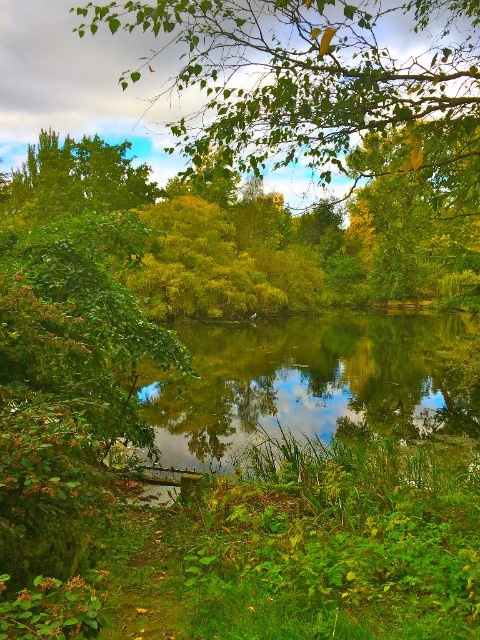
You are standing at the center of the scene and want to locate the green leafy tree at upper center. According to the coordinates provided, where should you look?

The green leafy tree at upper center is located at coordinates point (312, 77).

Looking at this image, you are standing at the edge of the pond and notice a point marked at coordinates (312, 77) in the scene. Based on the description, where is this point located?

The point is located on the green leafy tree at upper center.

You are standing at the edge of the pond and want to compare the sizes of the green leafy tree at upper center and the green reflective water at center. Which one appears wider?

The green reflective water at center is wider than the green leafy tree at upper center because the tree has a smaller width compared to the water.